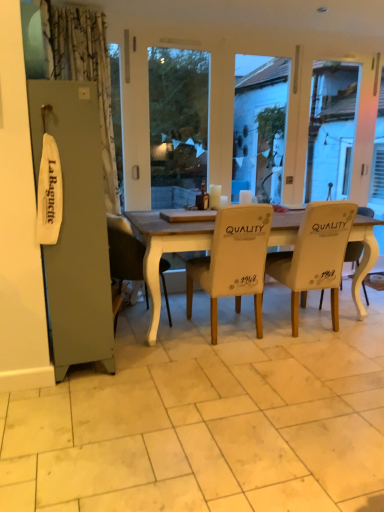
Question: Does white fabric chair at right, positioned as the fourth chair in left-to-right order, have a lesser height compared to white fabric chair at center, which is counted as the 4th chair, starting from the right?

Choices:
 (A) no
 (B) yes

Answer: (B)

Question: Is white fabric chair at right, positioned as the fourth chair in left-to-right order, positioned behind white fabric chair at center, which is counted as the 4th chair, starting from the right?

Choices:
 (A) no
 (B) yes

Answer: (B)

Question: Can we say white fabric chair at right, arranged as the first chair when viewed from the right, lies outside white fabric chair at center, acting as the 1th chair starting from the left?

Choices:
 (A) yes
 (B) no

Answer: (A)

Question: From the image's perspective, is white fabric chair at right, arranged as the first chair when viewed from the right, on white fabric chair at center, which is counted as the 4th chair, starting from the right?

Choices:
 (A) yes
 (B) no

Answer: (A)

Question: Would you say white fabric chair at center, acting as the 1th chair starting from the left, is part of white fabric chair at right, positioned as the fourth chair in left-to-right order,'s contents?

Choices:
 (A) yes
 (B) no

Answer: (B)

Question: Is white fabric chair at right, positioned as the fourth chair in left-to-right order, inside or outside of white fabric chair at center, which is counted as the 4th chair, starting from the right?

Choices:
 (A) outside
 (B) inside

Answer: (A)

Question: Is white fabric chair at right, arranged as the first chair when viewed from the right, wider or thinner than white fabric chair at center, which is counted as the 4th chair, starting from the right?

Choices:
 (A) thin
 (B) wide

Answer: (B)

Question: Is point 364,259 positioned closer to the camera than point 125,236?

Choices:
 (A) farther
 (B) closer

Answer: (A)

Question: Considering the relative positions of white fabric chair at right, arranged as the first chair when viewed from the right, and white fabric chair at center, which is counted as the 4th chair, starting from the right, in the image provided, is white fabric chair at right, arranged as the first chair when viewed from the right, to the left or to the right of white fabric chair at center, which is counted as the 4th chair, starting from the right,?

Choices:
 (A) right
 (B) left

Answer: (A)

Question: Considering the relative positions of white fabric chair at center, acting as the 1th chair starting from the left, and white tile at center in the image provided, is white fabric chair at center, acting as the 1th chair starting from the left, to the left or to the right of white tile at center?

Choices:
 (A) right
 (B) left

Answer: (B)

Question: Is point (117, 222) closer or farther from the camera than point (119, 374)?

Choices:
 (A) farther
 (B) closer

Answer: (A)

Question: From the image's perspective, is white fabric chair at center, which is counted as the 4th chair, starting from the right, positioned above or below white tile at center?

Choices:
 (A) below
 (B) above

Answer: (B)

Question: From a real-world perspective, is white fabric chair at center, which is counted as the 4th chair, starting from the right, positioned above or below white tile at center?

Choices:
 (A) below
 (B) above

Answer: (B)

Question: In the image, is white leather chair at center, the 2th chair positioned from the left, on the left side or the right side of white fabric chair at right, positioned as the fourth chair in left-to-right order?

Choices:
 (A) right
 (B) left

Answer: (B)

Question: Considering the positions of white leather chair at center, the 3th chair viewed from the right, and white fabric chair at right, arranged as the first chair when viewed from the right, in the image, is white leather chair at center, the 3th chair viewed from the right, bigger or smaller than white fabric chair at right, arranged as the first chair when viewed from the right,?

Choices:
 (A) big
 (B) small

Answer: (A)